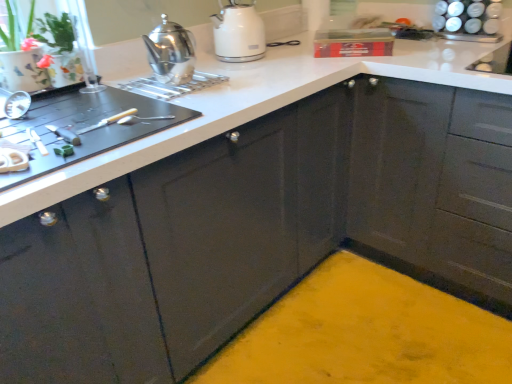
At what (x,y) coordinates should I click in order to perform the action: click on free space in front of white glossy kettle at upper center, the second kitchen appliance from the front. Please return your answer as a coordinate pair (x, y). Looking at the image, I should click on pyautogui.click(x=247, y=69).